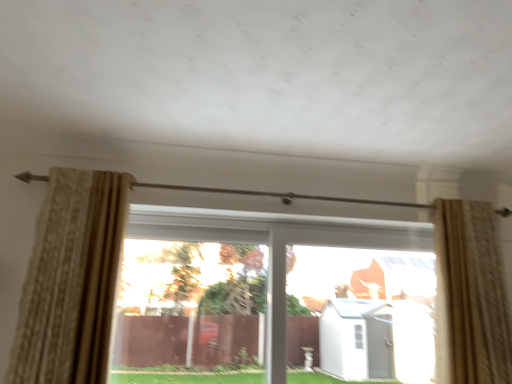
Question: In the image, is beige textured curtain at left, the first curtain viewed from the left, on the left side or the right side of transparent glass window at center, the 2th window in the left-to-right sequence?

Choices:
 (A) right
 (B) left

Answer: (B)

Question: Is beige textured curtain at left, the first curtain viewed from the left, situated inside transparent glass window at center, the first window when ordered from right to left, or outside?

Choices:
 (A) inside
 (B) outside

Answer: (B)

Question: Which object is positioned farthest from the beige textured curtain at right, the 2th curtain when ordered from left to right?

Choices:
 (A) beige textured curtain at left, the second curtain viewed from the right
 (B) transparent glass window at center, the first window when ordered from right to left
 (C) transparent glass window at center, which is the 2th window from right to left

Answer: (A)

Question: Estimate the real-world distances between objects in this image. Which object is closer to the beige textured curtain at left, the first curtain viewed from the left?

Choices:
 (A) transparent glass window at center, which is the 2th window from right to left
 (B) transparent glass window at center, the first window when ordered from right to left
 (C) beige textured curtain at right, the 1th curtain in the right-to-left sequence

Answer: (A)